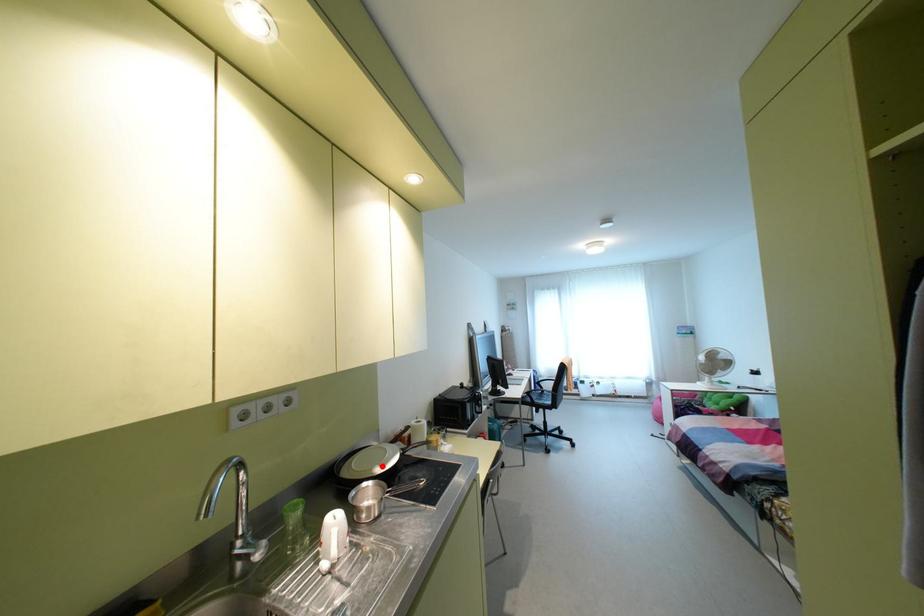
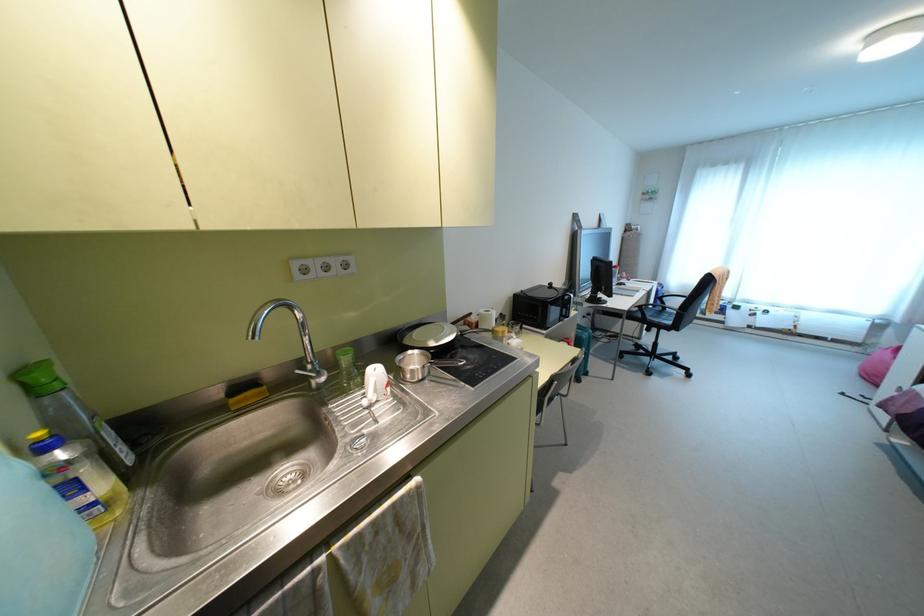
Find the pixel in the second image that matches the highlighted location in the first image.

(435, 341)